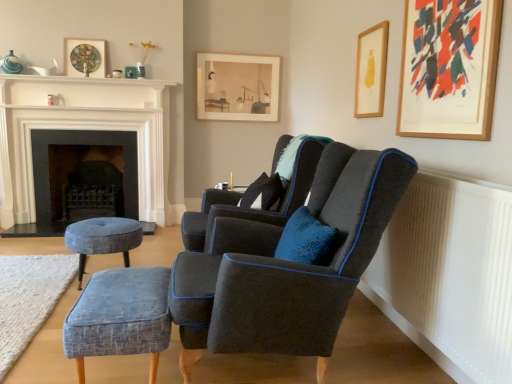
I want to click on free point above matte glass picture frame at upper left, which is counted as the first picture frame, starting from the left (from a real-world perspective), so pos(86,39).